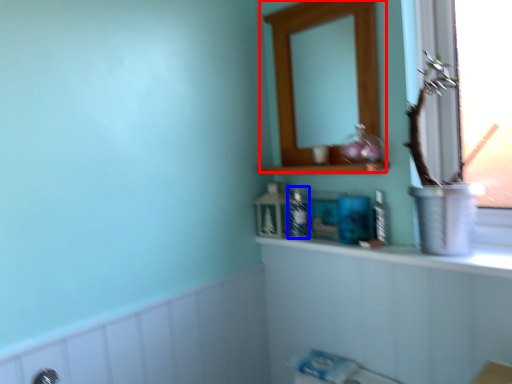
Question: Which of the following is the closest to the observer, medicine cabinet (highlighted by a red box) or toiletry (highlighted by a blue box)?

Choices:
 (A) medicine cabinet
 (B) toiletry

Answer: (A)